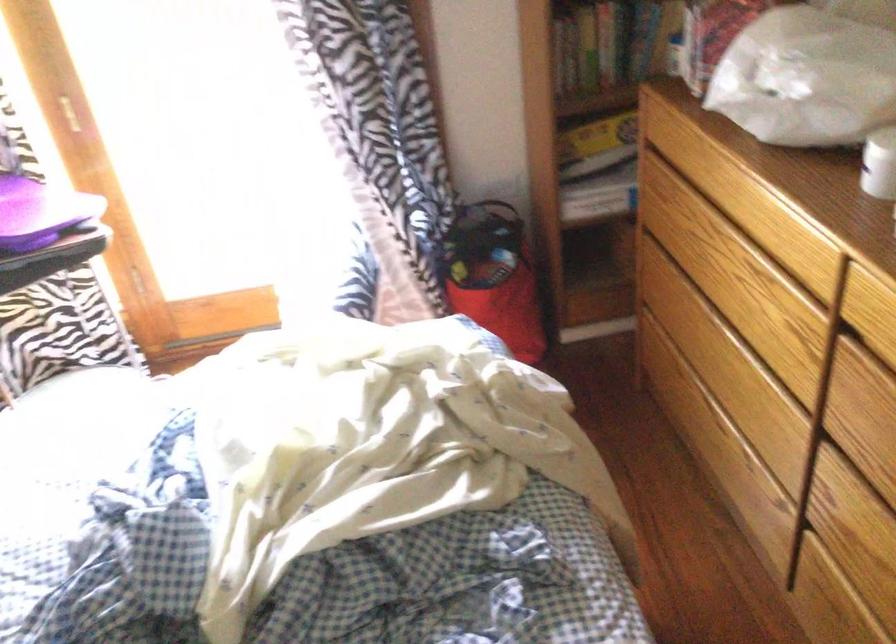
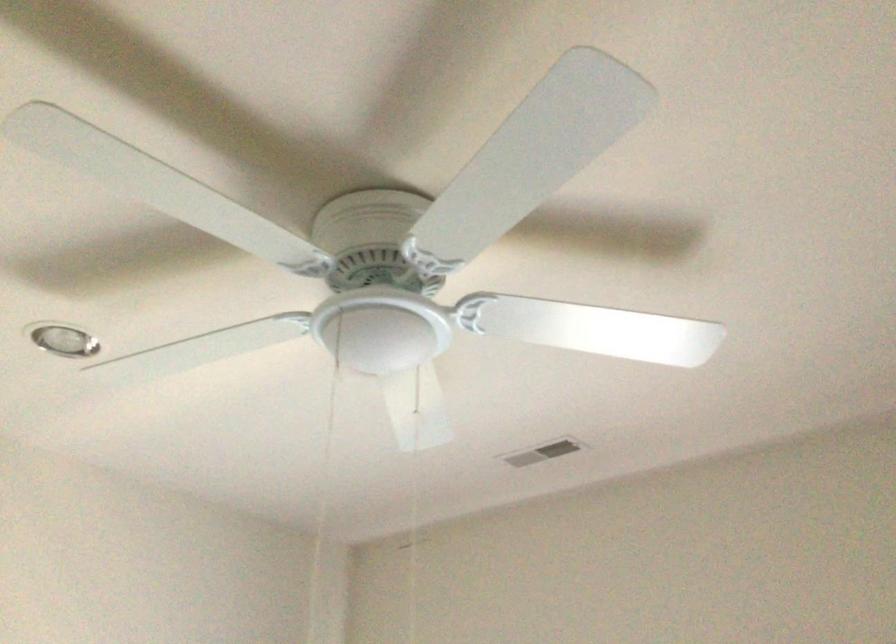
How did the camera likely rotate?

The camera's rotation is toward left-up.